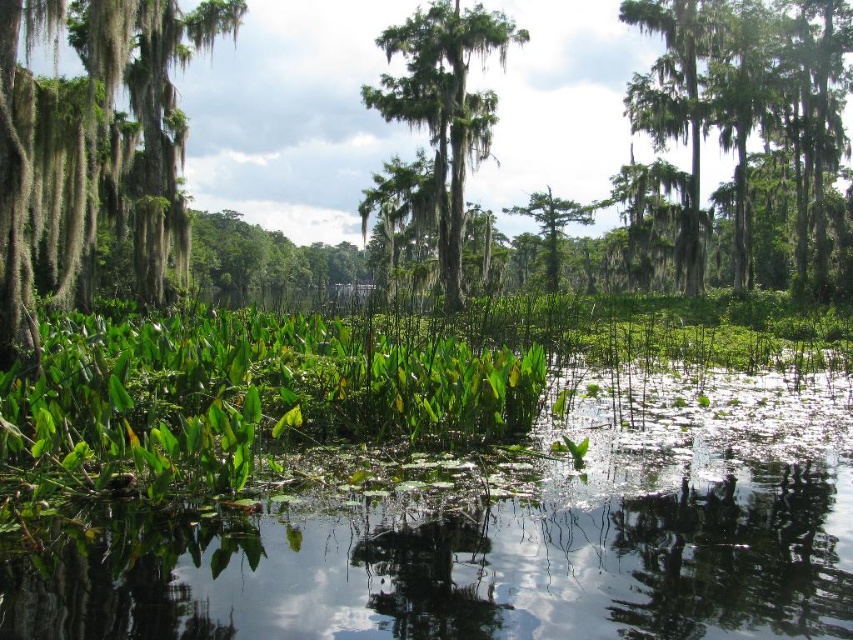
You are standing in the swamp and see the green mossy tree at center and the green leafy tree at center. Which tree is positioned more to the left side of the image?

The green mossy tree at center is positioned more to the left side of the image compared to the green leafy tree at center.

You are standing at the center of the swamp and see the point marked at coordinates (x=94, y=147). What is located at that point?

The point at (x=94, y=147) is occupied by a green mossy tree at left.

You are navigating a small boat through the swamp and want to reach a destination located at point [757,17]. Your current position is at point [434,83]. Based on the swamp layout, will you have to go around any obstacles between these two points?

Point [757,17] is behind point [434,83], so you will have to go around obstacles between these two points since they are not in a straight line path.